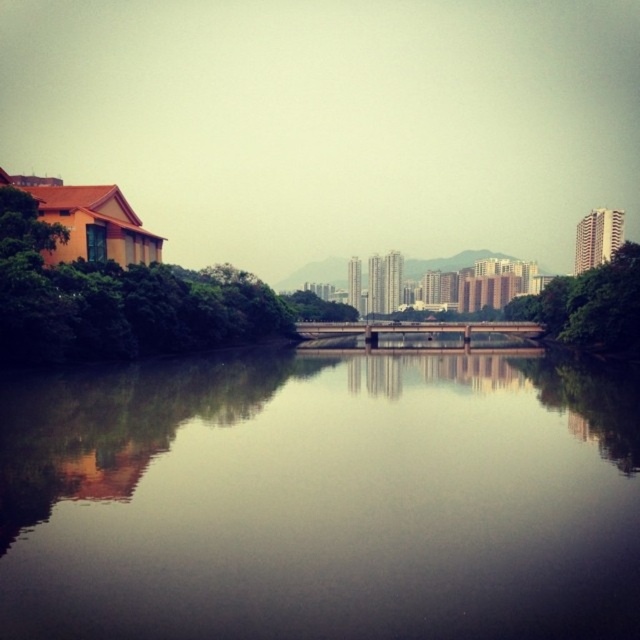
Is green leafy tree at left below green leafy tree at center?

Yes, green leafy tree at left is below green leafy tree at center.

At what (x,y) coordinates should I click in order to perform the action: click on green leafy tree at left. Please return your answer as a coordinate pair (x, y). This screenshot has width=640, height=640. Looking at the image, I should click on (116, 301).

Is smooth reflective water at center behind green leafy tree at center?

No, smooth reflective water at center is closer to the viewer.

Is smooth reflective water at center below green leafy tree at center?

Yes, smooth reflective water at center is below green leafy tree at center.

What do you see at coordinates (321, 499) in the screenshot? Image resolution: width=640 pixels, height=640 pixels. I see `smooth reflective water at center` at bounding box center [321, 499].

The height and width of the screenshot is (640, 640). I want to click on smooth reflective water at center, so click(x=321, y=499).

Describe the element at coordinates (321, 499) in the screenshot. I see `smooth reflective water at center` at that location.

Find the location of `smooth reflective water at center`. smooth reflective water at center is located at coordinates (321, 499).